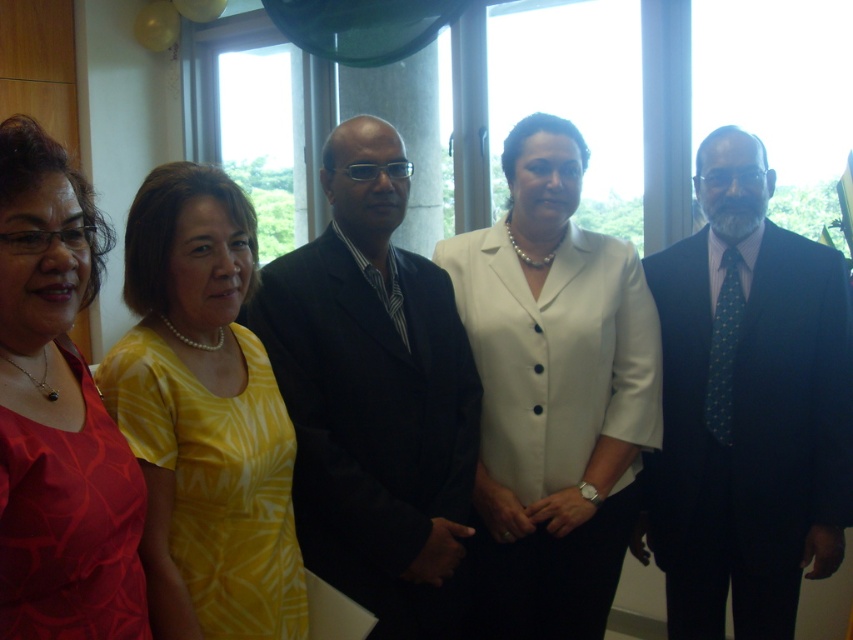
You are a photographer at the event and need to adjust the lighting to ensure both the white satin blouse at center and the yellow printed dress at center are equally visible. Given their sizes, which one might require more focused lighting?

The white satin blouse at center is bigger than the yellow printed dress at center, so it might require more focused lighting to ensure visibility.

You are standing at the entrance of the room and want to approach the black suit at center. Which direction should you move to reach it?

The black suit at center is located at point (x=374, y=396), so you should move towards the center of the room to reach it.

You are a photographer at the event and need to ensure all attendees are visible in a group photo. The white satin blouse at center and yellow printed dress at center are both at the center of the image. Which one might block the view of the other if they are standing close together?

The white satin blouse at center is much taller than the yellow printed dress at center, so it might block the view of the yellow printed dress at center if they are standing close together.